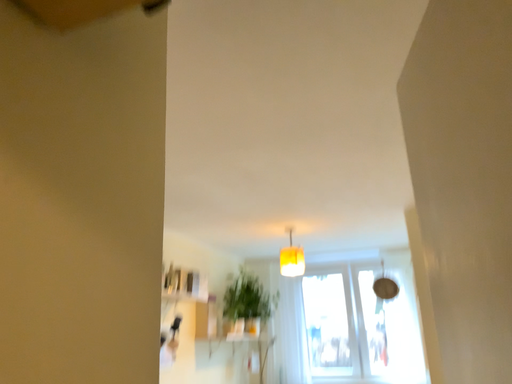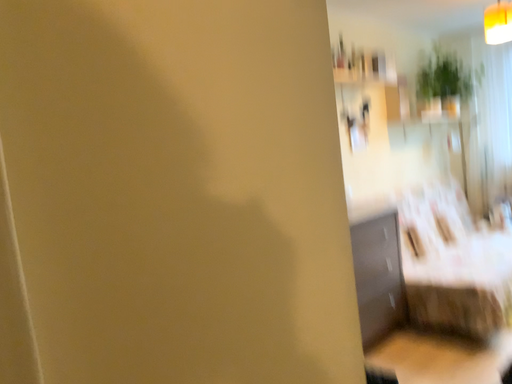
Question: How did the camera likely rotate when shooting the video?

Choices:
 (A) rotated downward
 (B) rotated upward

Answer: (A)